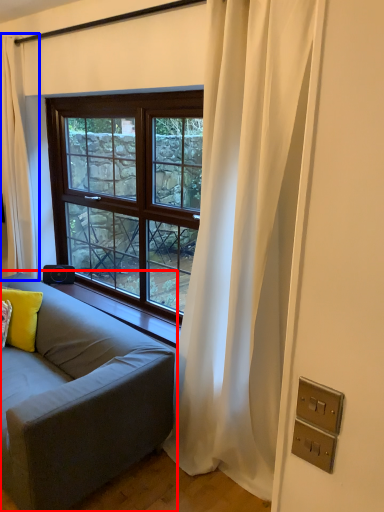
Question: Which of the following is the closest to the observer, studio couch (highlighted by a red box) or curtain (highlighted by a blue box)?

Choices:
 (A) studio couch
 (B) curtain

Answer: (A)